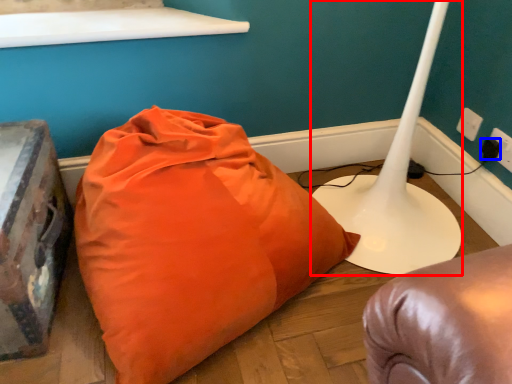
Question: Which object is closer to the camera taking this photo, table lamp (highlighted by a red box) or plug (highlighted by a blue box)?

Choices:
 (A) table lamp
 (B) plug

Answer: (A)